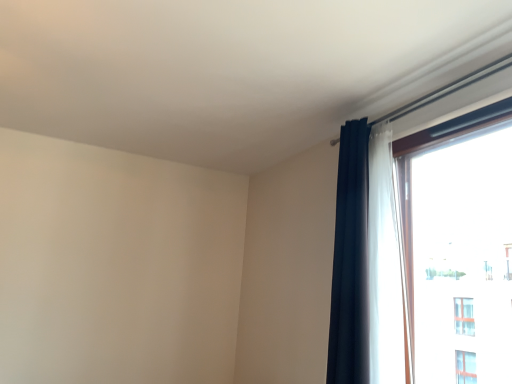
This screenshot has width=512, height=384. Describe the element at coordinates (368, 265) in the screenshot. I see `white sheer curtain at right` at that location.

Image resolution: width=512 pixels, height=384 pixels. In order to click on white sheer curtain at right in this screenshot , I will do `click(368, 265)`.

Identify the location of white sheer curtain at right. (368, 265).